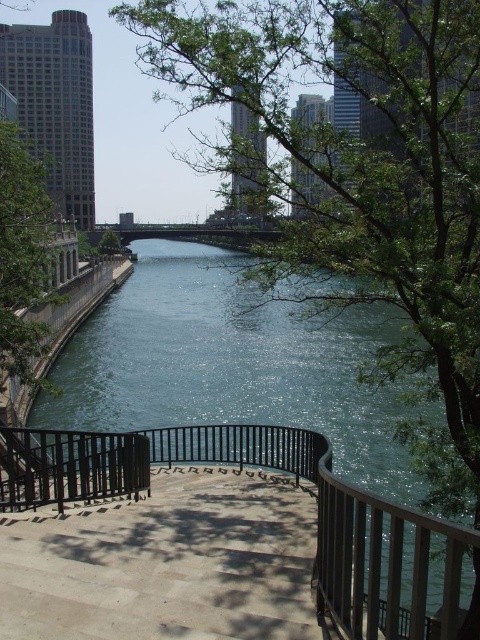
Does green leafy tree at left have a greater width compared to green leafy tree at center?

Correct, the width of green leafy tree at left exceeds that of green leafy tree at center.

Is point (21, 212) in front of point (119, 243)?

Yes, point (21, 212) is in front of point (119, 243).

You are a GUI agent. You are given a task and a screenshot of the screen. Output one action in this format:
    pyautogui.click(x=<x>, y=<y>)
    Task: Click on the green leafy tree at left
    Image resolution: width=480 pixels, height=640 pixels.
    Given the screenshot: What is the action you would take?
    pyautogui.click(x=23, y=253)

In the scene shown: Who is lower down, black metal railing at center or green leafy tree at center?

Positioned lower is black metal railing at center.

At what (x,y) coordinates should I click in order to perform the action: click on black metal railing at center. Please return your answer as a coordinate pair (x, y). The width and height of the screenshot is (480, 640). Looking at the image, I should click on (296, 483).

Who is more distant from viewer, (x=452, y=557) or (x=35, y=202)?

Positioned behind is point (x=35, y=202).

Does point (35, 484) lie in front of point (44, 173)?

Yes, point (35, 484) is in front of point (44, 173).

Does point (389, 586) come behind point (0, 198)?

No.

You are a GUI agent. You are given a task and a screenshot of the screen. Output one action in this format:
    pyautogui.click(x=<x>, y=<y>)
    Task: Click on the black metal railing at center
    The image size is (480, 640).
    Given the screenshot: What is the action you would take?
    pyautogui.click(x=296, y=483)